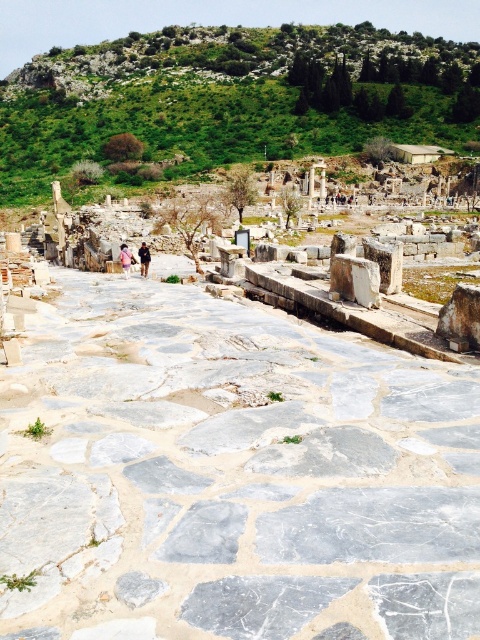
Question: Does green grassy hillside at upper center have a smaller size compared to pink fabric at center?

Choices:
 (A) no
 (B) yes

Answer: (A)

Question: Which point is farther to the camera?

Choices:
 (A) (120, 408)
 (B) (355, 51)
 (C) (144, 248)

Answer: (B)

Question: Which point appears closest to the camera in this image?

Choices:
 (A) (120, 252)
 (B) (142, 257)
 (C) (252, 60)
 (D) (44, 500)

Answer: (D)

Question: Is gray marble stone at center closer to the viewer compared to green grassy hillside at upper center?

Choices:
 (A) yes
 (B) no

Answer: (A)

Question: Among these objects, which one is nearest to the camera?

Choices:
 (A) pink fabric person at center
 (B) gray marble stone at center

Answer: (B)

Question: Is green grassy hillside at upper center positioned at the back of pink fabric at center?

Choices:
 (A) no
 (B) yes

Answer: (B)